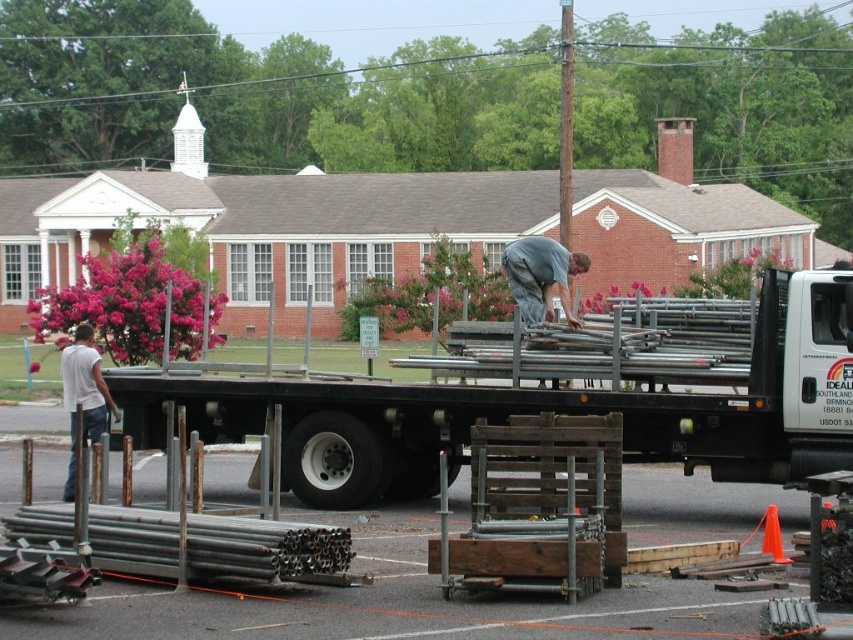
You are a delivery driver who needs to park your metallic silver trailer truck at center in a parking space that is exactly the width of the gray fabric shirt at center. Will the truck fit without overlapping the parking space boundaries?

The metallic silver trailer truck at center has a lesser width compared to the gray fabric shirt at center, so it will fit within the parking space without overlapping the boundaries.

You are standing at the origin point in the image. Where is the metallic silver trailer truck at center located?

The metallic silver trailer truck at center is located at point 2D coordinates of (550, 403).

You are a delivery driver who just arrived at the construction site. You see the metallic silver trailer truck at center and the white cotton shirt at left. Which object is higher up from the ground?

The metallic silver trailer truck at center is located above the white cotton shirt at left, so the metallic silver trailer truck at center is higher up from the ground.